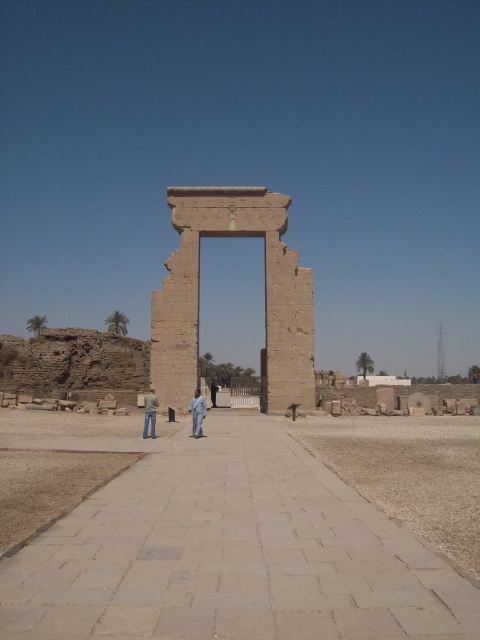
You are standing at the archaeological site and notice a point marked at coordinates (196,413). What object is located at that specific point?

The light brown fabric at center is located at point (196,413).

You are a tour guide explaining the ancient stone archway to visitors. You point out the light brown fabric at center and the jeans at center. How far apart are these two items from each other?

The light brown fabric at center is 3.47 meters from the jeans at center.